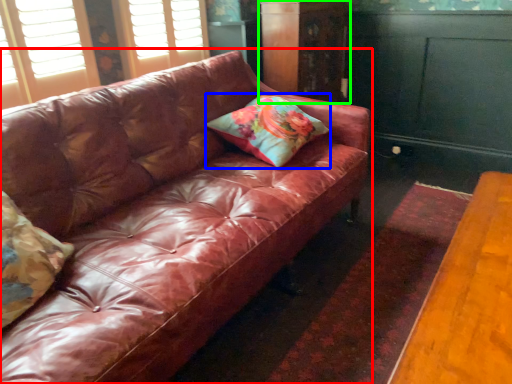
Question: Which object is the farthest from studio couch (highlighted by a red box)? Choose among these: pillow (highlighted by a blue box) or dresser (highlighted by a green box).

Choices:
 (A) pillow
 (B) dresser

Answer: (B)